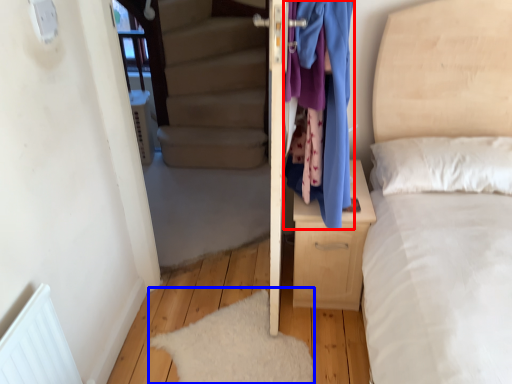
Question: Which object is further to the camera taking this photo, clothing (highlighted by a red box) or mat (highlighted by a blue box)?

Choices:
 (A) clothing
 (B) mat

Answer: (B)